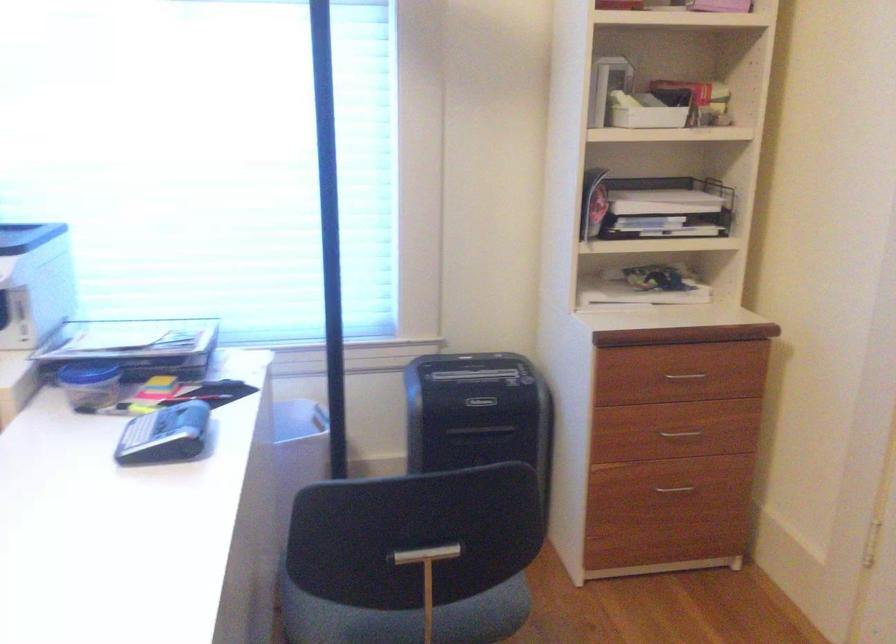
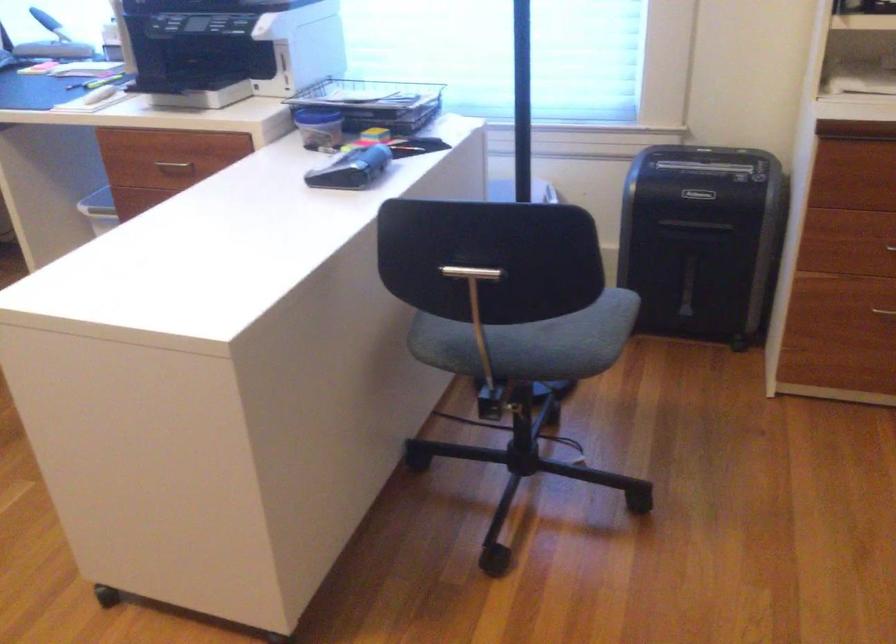
Find the pixel in the second image that matches pixel 183 438 in the first image.

(351, 169)